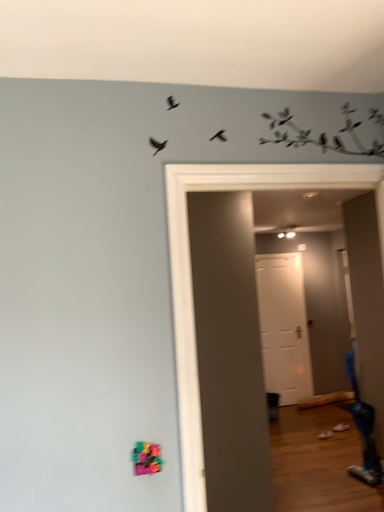
What is the approximate width of white matte door at center?

2.77 inches.

Describe the element at coordinates (284, 326) in the screenshot. I see `white matte door at center` at that location.

Identify the location of white matte door at center. (284, 326).

What is the approximate width of blue plastic swivel chair at lower right?

blue plastic swivel chair at lower right is 9.41 inches wide.

Locate an element on the screen. This screenshot has height=512, width=384. blue plastic swivel chair at lower right is located at coordinates (x=364, y=431).

Image resolution: width=384 pixels, height=512 pixels. What do you see at coordinates (364, 431) in the screenshot?
I see `blue plastic swivel chair at lower right` at bounding box center [364, 431].

Identify the location of white matte door at center. (284, 326).

Considering the relative positions of blue plastic swivel chair at lower right and white matte door at center in the image provided, is blue plastic swivel chair at lower right to the right of white matte door at center from the viewer's perspective?

Correct, you'll find blue plastic swivel chair at lower right to the right of white matte door at center.

Looking at this image, in the image, is blue plastic swivel chair at lower right positioned in front of or behind white matte door at center?

Clearly, blue plastic swivel chair at lower right is in front of white matte door at center.

Which point is more distant from viewer, (369, 413) or (281, 387)?

The point (281, 387) is farther from the camera.

From the image's perspective, who appears lower, blue plastic swivel chair at lower right or white matte door at center?

blue plastic swivel chair at lower right.

From a real-world perspective, who is located higher, blue plastic swivel chair at lower right or white matte door at center?

white matte door at center is physically above.

Does blue plastic swivel chair at lower right have a greater width compared to white matte door at center?

Correct, the width of blue plastic swivel chair at lower right exceeds that of white matte door at center.

Who is taller, blue plastic swivel chair at lower right or white matte door at center?

Standing taller between the two is white matte door at center.

Looking at the image, does blue plastic swivel chair at lower right seem bigger or smaller compared to white matte door at center?

Clearly, blue plastic swivel chair at lower right is smaller in size than white matte door at center.

Is white matte door at center located within blue plastic swivel chair at lower right?

Definitely not — white matte door at center is not inside blue plastic swivel chair at lower right.

Is there a large distance between blue plastic swivel chair at lower right and white matte door at center?

blue plastic swivel chair at lower right is far away from white matte door at center.

Does blue plastic swivel chair at lower right turn towards white matte door at center?

No, blue plastic swivel chair at lower right does not turn towards white matte door at center.

How many degrees apart are the facing directions of blue plastic swivel chair at lower right and white matte door at center?

The angular difference between blue plastic swivel chair at lower right and white matte door at center is 83.9 degrees.

At what (x,y) coordinates should I click in order to perform the action: click on door above the blue plastic swivel chair at lower right (from the image's perspective). Please return your answer as a coordinate pair (x, y). The width and height of the screenshot is (384, 512). Looking at the image, I should click on (284, 326).

Can you confirm if white matte door at center is positioned to the left of blue plastic swivel chair at lower right?

Correct, you'll find white matte door at center to the left of blue plastic swivel chair at lower right.

Relative to blue plastic swivel chair at lower right, is white matte door at center in front or behind?

Visually, white matte door at center is located behind blue plastic swivel chair at lower right.

Is point (310, 376) positioned after point (358, 402)?

That is True.

From the picture: From the image's perspective, is white matte door at center positioned above or below blue plastic swivel chair at lower right?

From the image's perspective, white matte door at center appears above blue plastic swivel chair at lower right.

From a real-world perspective, does white matte door at center stand above blue plastic swivel chair at lower right?

Yes, from a real-world perspective, white matte door at center is above blue plastic swivel chair at lower right.

Looking at their sizes, would you say white matte door at center is wider or thinner than blue plastic swivel chair at lower right?

white matte door at center is thinner than blue plastic swivel chair at lower right.

From their relative heights in the image, would you say white matte door at center is taller or shorter than blue plastic swivel chair at lower right?

Considering their sizes, white matte door at center has more height than blue plastic swivel chair at lower right.

Does white matte door at center have a larger size compared to blue plastic swivel chair at lower right?

Yes.

Is white matte door at center spatially inside blue plastic swivel chair at lower right, or outside of it?

white matte door at center is outside blue plastic swivel chair at lower right.

Is white matte door at center positioned far away from blue plastic swivel chair at lower right?

Indeed, white matte door at center is not near blue plastic swivel chair at lower right.

Is white matte door at center oriented away from blue plastic swivel chair at lower right?

No.

This screenshot has width=384, height=512. I want to click on door on the left of blue plastic swivel chair at lower right, so click(x=284, y=326).

This screenshot has height=512, width=384. I want to click on door on the left of blue plastic swivel chair at lower right, so click(284, 326).

You are a GUI agent. You are given a task and a screenshot of the screen. Output one action in this format:
    pyautogui.click(x=<x>, y=<y>)
    Task: Click on the door behind the blue plastic swivel chair at lower right
    The width and height of the screenshot is (384, 512).
    Given the screenshot: What is the action you would take?
    pyautogui.click(x=284, y=326)